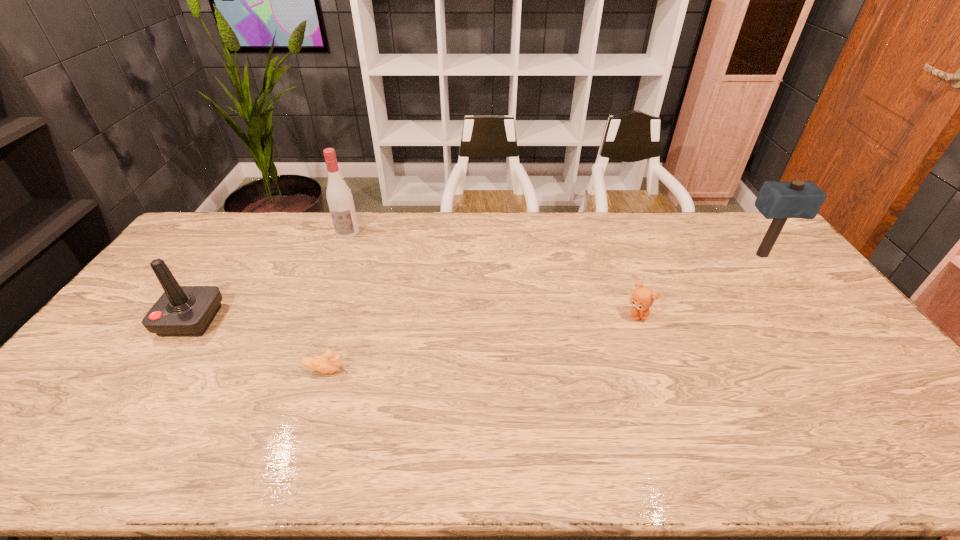
Find the location of a particular element. This screenshot has width=960, height=540. the farthest object is located at coordinates (339, 197).

Find the location of a particular element. the rightmost object is located at coordinates pos(779,201).

Identify the location of the fourth nearest object. (779, 201).

Locate an element on the screen. The height and width of the screenshot is (540, 960). joystick is located at coordinates (182, 311).

Where is `the leftmost object`? The width and height of the screenshot is (960, 540). the leftmost object is located at coordinates (182, 311).

You are a GUI agent. You are given a task and a screenshot of the screen. Output one action in this format:
    pyautogui.click(x=<x>, y=<y>)
    Task: Click on the second shortest object
    
    Given the screenshot: What is the action you would take?
    pyautogui.click(x=642, y=298)

This screenshot has height=540, width=960. I want to click on the second object from right to left, so click(x=642, y=298).

Locate an element on the screen. The image size is (960, 540). the nearest object is located at coordinates (329, 363).

Identify the location of the shortest object. The height and width of the screenshot is (540, 960). 329,363.

Find the location of a particular element. The width and height of the screenshot is (960, 540). free space located on the label of the alcohol is located at coordinates (331, 275).